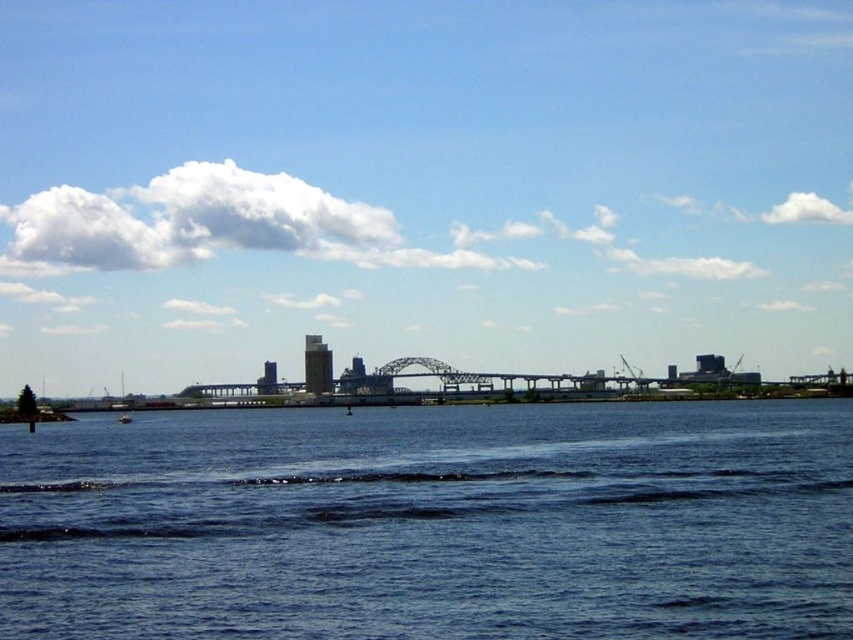
Question: Is blue water at lower center smaller than white plastic boat at lower left?

Choices:
 (A) no
 (B) yes

Answer: (A)

Question: Does blue sky at upper center have a greater width compared to white plastic boat at lower left?

Choices:
 (A) yes
 (B) no

Answer: (A)

Question: Which of the following is the farthest from the observer?

Choices:
 (A) white plastic boat at lower left
 (B) blue water at lower center

Answer: (A)

Question: Which of these objects is positioned farthest from the blue water at lower center?

Choices:
 (A) white plastic boat at lower left
 (B) blue sky at upper center

Answer: (A)

Question: Which of the following is the closest to the observer?

Choices:
 (A) blue water at lower center
 (B) white plastic boat at lower left

Answer: (A)

Question: Is blue sky at upper center to the right of white plastic boat at lower left from the viewer's perspective?

Choices:
 (A) yes
 (B) no

Answer: (A)